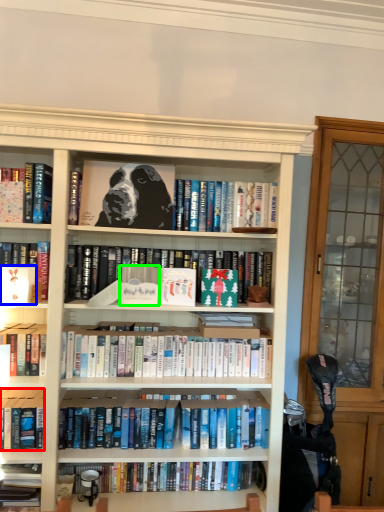
Question: Which object is positioned closest to book (highlighted by a red box)? Select from paperback book (highlighted by a blue box) and paperback book (highlighted by a green box).

Choices:
 (A) paperback book
 (B) paperback book

Answer: (A)